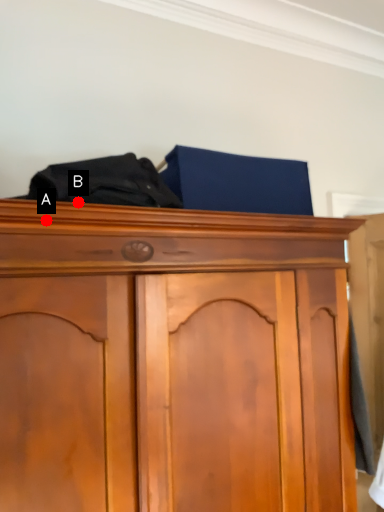
Question: Two points are circled on the image, labeled by A and B beside each circle. Among these points, which one is nearest to the camera?

Choices:
 (A) A is closer
 (B) B is closer

Answer: (A)